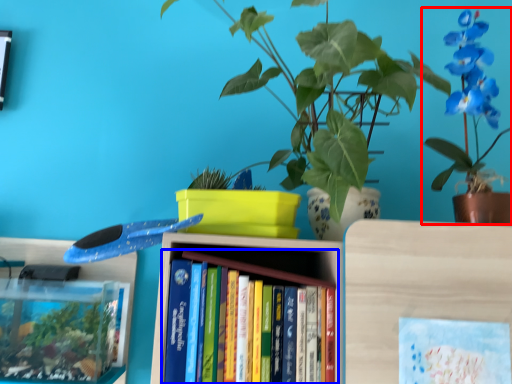
Question: Which object appears closest to the camera in this image, houseplant (highlighted by a red box) or book (highlighted by a blue box)?

Choices:
 (A) houseplant
 (B) book

Answer: (B)